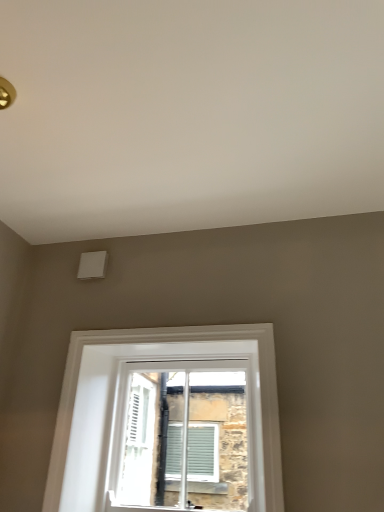
What do you see at coordinates (125, 405) in the screenshot? The width and height of the screenshot is (384, 512). I see `white plastic window at center, positioned as the 1th window in front-to-back order` at bounding box center [125, 405].

Identify the location of white plastic window at center, positioned as the 1th window in front-to-back order. The height and width of the screenshot is (512, 384). (125, 405).

At what (x,y) coordinates should I click in order to perform the action: click on white glass window at center, which is the 1th window in back-to-front order. Please return your answer as a coordinate pair (x, y). Looking at the image, I should click on (182, 437).

The width and height of the screenshot is (384, 512). What do you see at coordinates (182, 437) in the screenshot? I see `white glass window at center, which is the 1th window in back-to-front order` at bounding box center [182, 437].

In order to click on white plastic window at center, which ranks as the 2th window in back-to-front order in this screenshot , I will do `click(125, 405)`.

Between white plastic window at center, which ranks as the 2th window in back-to-front order, and white glass window at center, which is the 1th window in back-to-front order, which one appears on the right side from the viewer's perspective?

white glass window at center, which is the 1th window in back-to-front order.

Does white plastic window at center, which ranks as the 2th window in back-to-front order, lie in front of white glass window at center, the 2th window from the front?

That is True.

Considering the points (262, 462) and (187, 421), which point is in front, point (262, 462) or point (187, 421)?

Positioned in front is point (262, 462).

Looking at this image, from the image's perspective, is white plastic window at center, positioned as the 1th window in front-to-back order, located beneath white glass window at center, the 2th window from the front?

Incorrect, from the image's perspective, white plastic window at center, positioned as the 1th window in front-to-back order, is higher than white glass window at center, the 2th window from the front.

From a real-world perspective, is white plastic window at center, which ranks as the 2th window in back-to-front order, positioned under white glass window at center, which is the 1th window in back-to-front order, based on gravity?

No, from a real-world perspective, white plastic window at center, which ranks as the 2th window in back-to-front order, is not beneath white glass window at center, which is the 1th window in back-to-front order.

Between white plastic window at center, which ranks as the 2th window in back-to-front order, and white glass window at center, which is the 1th window in back-to-front order, which one has smaller width?

white plastic window at center, which ranks as the 2th window in back-to-front order.

Does white plastic window at center, positioned as the 1th window in front-to-back order, have a lesser height compared to white glass window at center, the 2th window from the front?

No.

Who is bigger, white plastic window at center, positioned as the 1th window in front-to-back order, or white glass window at center, the 2th window from the front?

white glass window at center, the 2th window from the front, is bigger.

Is white glass window at center, the 2th window from the front, completely or partially inside white plastic window at center, positioned as the 1th window in front-to-back order?

No, white glass window at center, the 2th window from the front, is not a part of white plastic window at center, positioned as the 1th window in front-to-back order.

Is white plastic window at center, positioned as the 1th window in front-to-back order, not close to white glass window at center, the 2th window from the front?

white plastic window at center, positioned as the 1th window in front-to-back order, is actually quite close to white glass window at center, the 2th window from the front.

In the scene shown: Is white plastic window at center, which ranks as the 2th window in back-to-front order, turned away from white glass window at center, the 2th window from the front?

Yes, white plastic window at center, which ranks as the 2th window in back-to-front order, is facing away from white glass window at center, the 2th window from the front.

How many degrees apart are the facing directions of white plastic window at center, positioned as the 1th window in front-to-back order, and white glass window at center, which is the 1th window in back-to-front order?

0.51 degrees separate the facing orientations of white plastic window at center, positioned as the 1th window in front-to-back order, and white glass window at center, which is the 1th window in back-to-front order.

At what (x,y) coordinates should I click in order to perform the action: click on window below the white plastic window at center, positioned as the 1th window in front-to-back order (from the image's perspective). Please return your answer as a coordinate pair (x, y). This screenshot has width=384, height=512. Looking at the image, I should click on (182, 437).

Between white glass window at center, which is the 1th window in back-to-front order, and white plastic window at center, which ranks as the 2th window in back-to-front order, which one appears on the left side from the viewer's perspective?

white plastic window at center, which ranks as the 2th window in back-to-front order.

Between white glass window at center, the 2th window from the front, and white plastic window at center, which ranks as the 2th window in back-to-front order, which one is positioned behind?

white glass window at center, the 2th window from the front, is more distant.

Considering the positions of point (188, 458) and point (258, 437), is point (188, 458) closer or farther from the camera than point (258, 437)?

Clearly, point (188, 458) is more distant from the camera than point (258, 437).

Based on the photo, from the image's perspective, does white glass window at center, which is the 1th window in back-to-front order, appear lower than white plastic window at center, positioned as the 1th window in front-to-back order?

Correct, white glass window at center, which is the 1th window in back-to-front order, appears lower than white plastic window at center, positioned as the 1th window in front-to-back order, in the image.

From a real-world perspective, is white glass window at center, the 2th window from the front, above or below white plastic window at center, positioned as the 1th window in front-to-back order?

In terms of real-world spatial position, white glass window at center, the 2th window from the front, is below white plastic window at center, positioned as the 1th window in front-to-back order.

Based on the photo, which object is thinner, white glass window at center, the 2th window from the front, or white plastic window at center, positioned as the 1th window in front-to-back order?

Thinner between the two is white plastic window at center, positioned as the 1th window in front-to-back order.

Is white glass window at center, which is the 1th window in back-to-front order, taller or shorter than white plastic window at center, positioned as the 1th window in front-to-back order?

Clearly, white glass window at center, which is the 1th window in back-to-front order, is shorter compared to white plastic window at center, positioned as the 1th window in front-to-back order.

Between white glass window at center, the 2th window from the front, and white plastic window at center, which ranks as the 2th window in back-to-front order, which one has smaller size?

white plastic window at center, which ranks as the 2th window in back-to-front order.

Is white glass window at center, which is the 1th window in back-to-front order, spatially inside white plastic window at center, which ranks as the 2th window in back-to-front order, or outside of it?

white glass window at center, which is the 1th window in back-to-front order, lies outside white plastic window at center, which ranks as the 2th window in back-to-front order.

Is white glass window at center, which is the 1th window in back-to-front order, with white plastic window at center, which ranks as the 2th window in back-to-front order?

white glass window at center, which is the 1th window in back-to-front order, is not next to white plastic window at center, which ranks as the 2th window in back-to-front order, and they're not touching.

Is white glass window at center, the 2th window from the front, oriented towards white plastic window at center, which ranks as the 2th window in back-to-front order?

Yes.

Can you tell me how much white glass window at center, the 2th window from the front, and white plastic window at center, positioned as the 1th window in front-to-back order, differ in facing direction?

The angular difference between white glass window at center, the 2th window from the front, and white plastic window at center, positioned as the 1th window in front-to-back order, is 0.51 degrees.

This screenshot has height=512, width=384. Find the location of `window in front of the white glass window at center, the 2th window from the front`. window in front of the white glass window at center, the 2th window from the front is located at coordinates (125, 405).

Image resolution: width=384 pixels, height=512 pixels. Find the location of `window behind the white plastic window at center, which ranks as the 2th window in back-to-front order`. window behind the white plastic window at center, which ranks as the 2th window in back-to-front order is located at coordinates (182, 437).

This screenshot has width=384, height=512. I want to click on window located in front of the white glass window at center, the 2th window from the front, so click(125, 405).